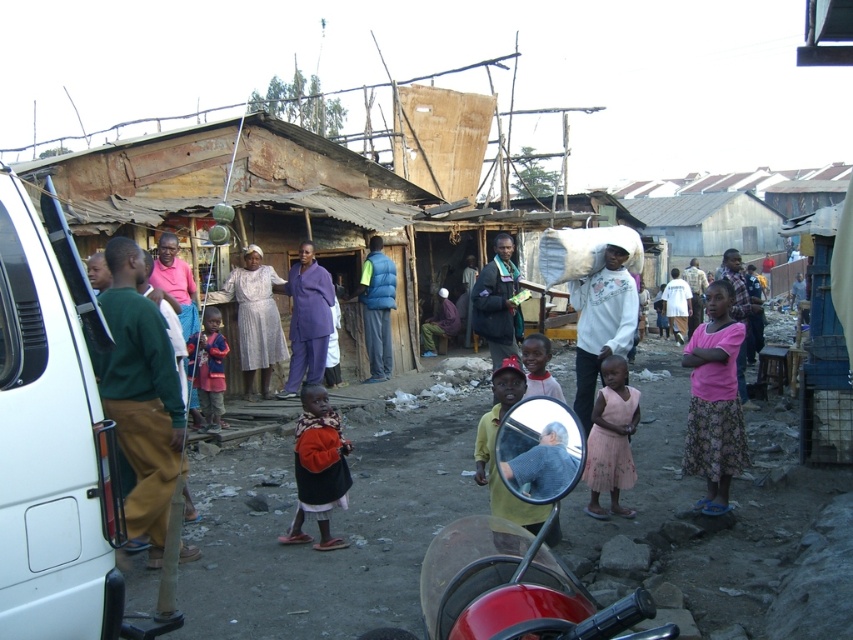
You are standing at the center of the scene and want to find the white cotton sweatshirt at center. According to the coordinates given, in which direction should you look relative to your current position?

The white cotton sweatshirt at center is located at coordinates point (601, 323). Since you are at the center, which is typically considered as point (426, 320), the sweatshirt is slightly to the upper right direction from your current position.

You are standing in front of the market stall and need to hand a document to the person wearing the dark blue jacket at center and the blue down jacket at center. Which jacket should you approach first to hand the document?

The dark blue jacket at center is closer to the viewer than the blue down jacket at center, so you should approach the dark blue jacket at center first to hand the document.